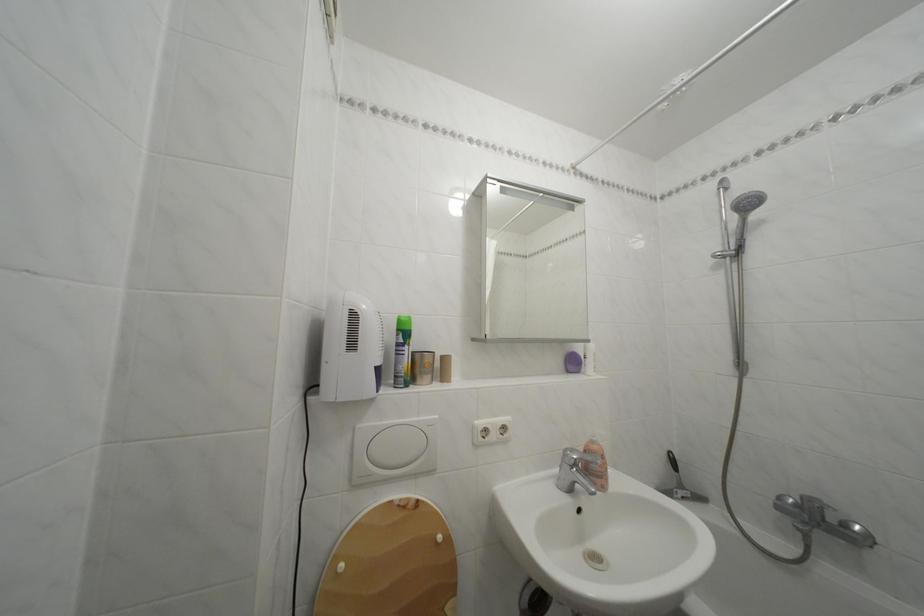
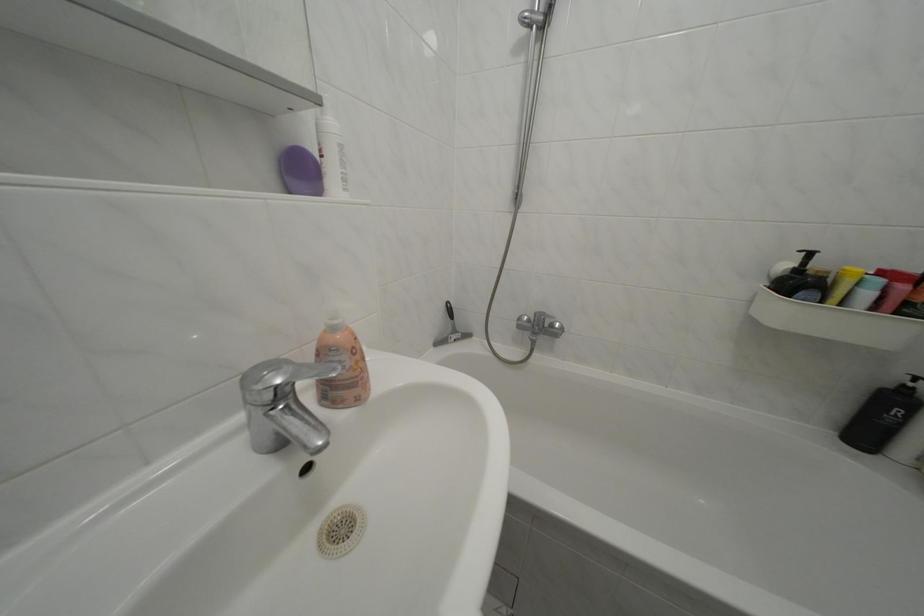
Where in the second image is the point corresponding to the point at 574,458 from the first image?

(252, 384)